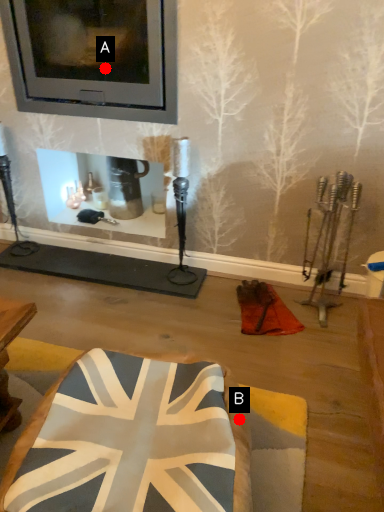
Question: Two points are circled on the image, labeled by A and B beside each circle. Which point appears farthest from the camera in this image?

Choices:
 (A) A is further
 (B) B is further

Answer: (A)